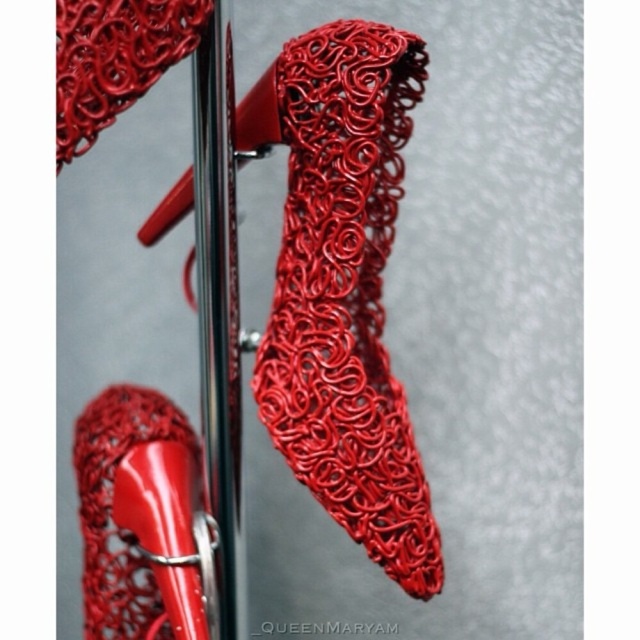
Question: Does shiny red wire at center have a smaller size compared to matte red shoe at center?

Choices:
 (A) yes
 (B) no

Answer: (A)

Question: Considering the relative positions of shiny red wire at center and matte red shoe at center in the image provided, where is shiny red wire at center located with respect to matte red shoe at center?

Choices:
 (A) above
 (B) below

Answer: (A)

Question: Can you confirm if shiny red wire at center is wider than matte red shoe at center?

Choices:
 (A) no
 (B) yes

Answer: (A)

Question: Among these points, which one is nearest to the camera?

Choices:
 (A) coord(177,538)
 (B) coord(362,67)

Answer: (B)